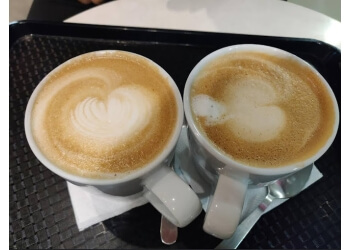
Identify the location of silverware handle. (170, 231).